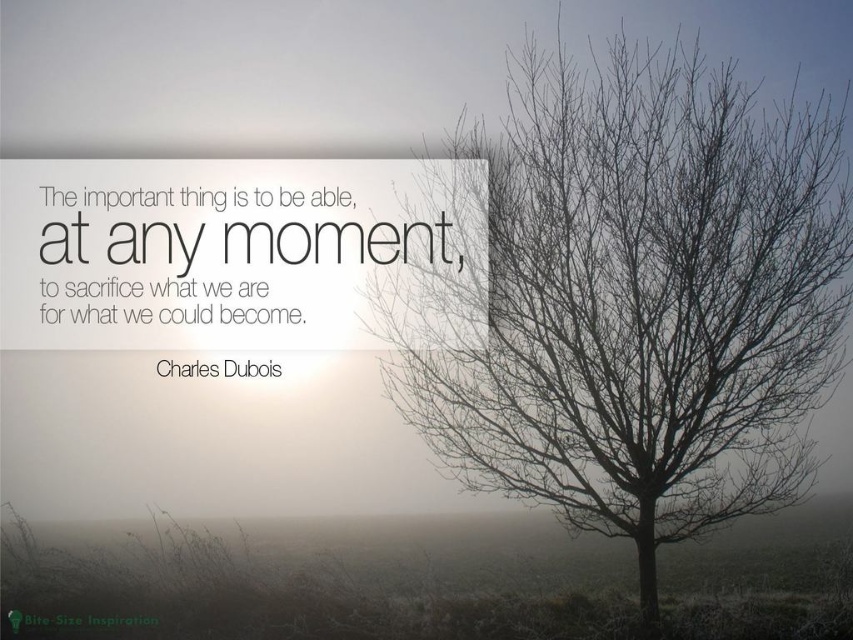
Question: Observing the image, what is the correct spatial positioning of bare branches at right in reference to green matte text at lower left?

Choices:
 (A) above
 (B) below

Answer: (A)

Question: Which point is closer to the camera taking this photo?

Choices:
 (A) (149, 625)
 (B) (560, 317)

Answer: (B)

Question: Is bare branches at right to the right of green matte text at lower left from the viewer's perspective?

Choices:
 (A) no
 (B) yes

Answer: (B)

Question: Can you confirm if bare branches at right is positioned to the left of green matte text at lower left?

Choices:
 (A) no
 (B) yes

Answer: (A)

Question: Which of the following is the closest to the observer?

Choices:
 (A) (61, 621)
 (B) (566, 493)

Answer: (B)